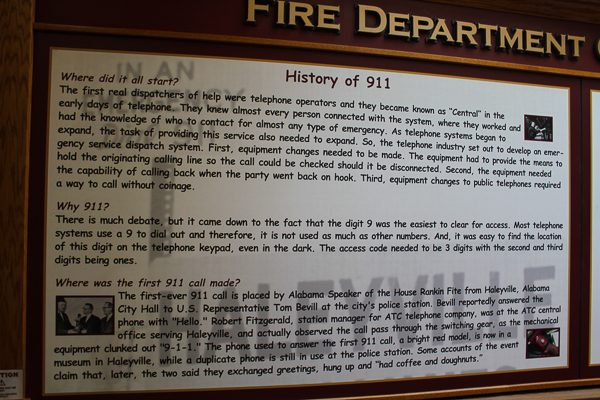
The width and height of the screenshot is (600, 400). Identify the location of wood paneling. (12, 193).